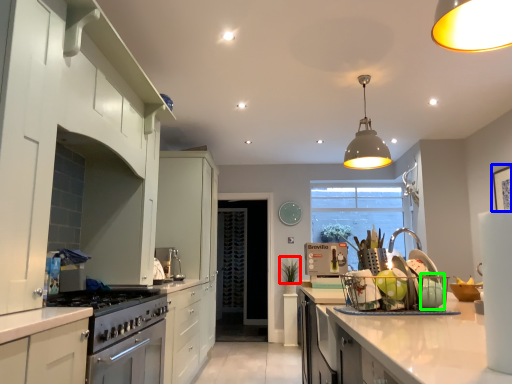
Question: Estimate the real-world distances between objects in this image. Which object is farther from plant (highlighted by a red box), picture frame (highlighted by a blue box) or appliance (highlighted by a green box)?

Choices:
 (A) picture frame
 (B) appliance

Answer: (B)